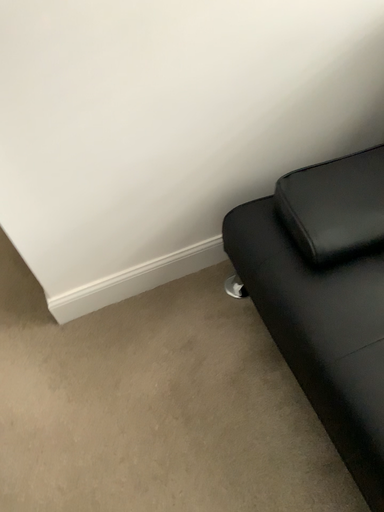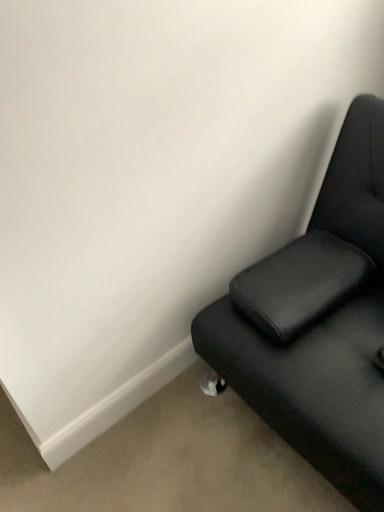
Question: Which way did the camera rotate in the video?

Choices:
 (A) rotated upward
 (B) rotated downward

Answer: (A)